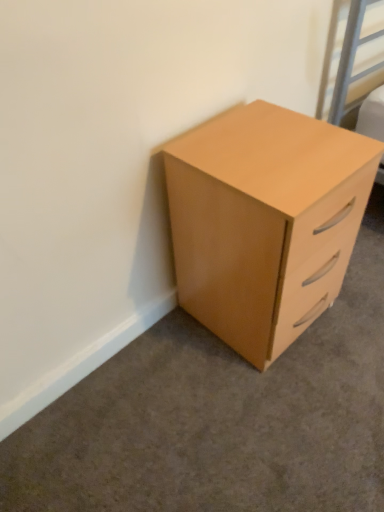
The width and height of the screenshot is (384, 512). I want to click on vacant area to the left of light brown wood chest of drawers at lower right, so click(x=161, y=360).